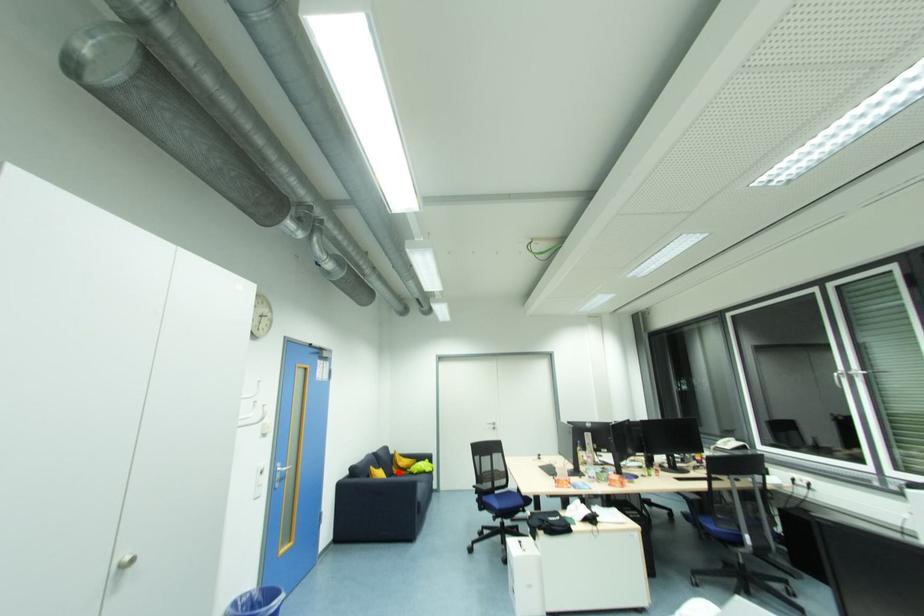
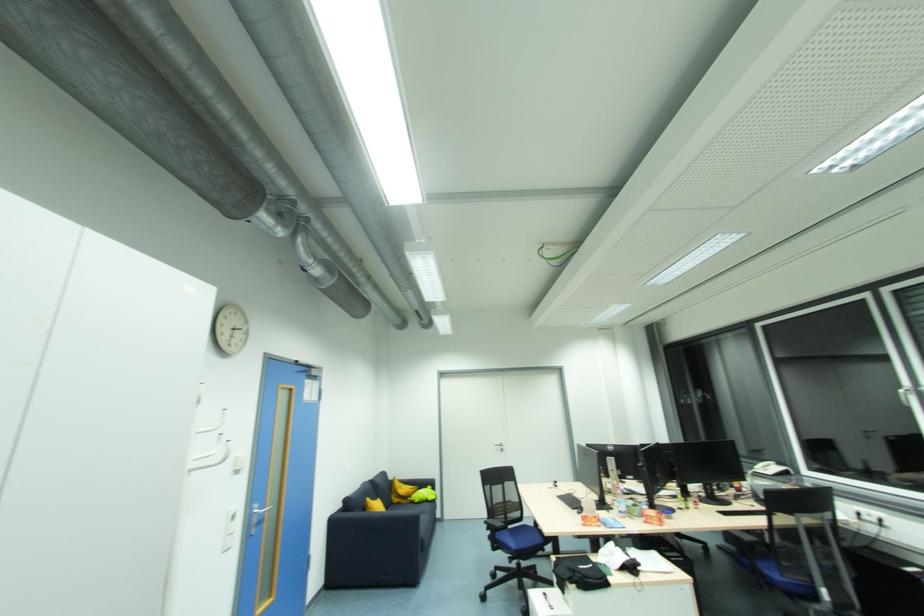
The point at the highlighted location is marked in the first image. Where is the corresponding point in the second image?

(397, 501)